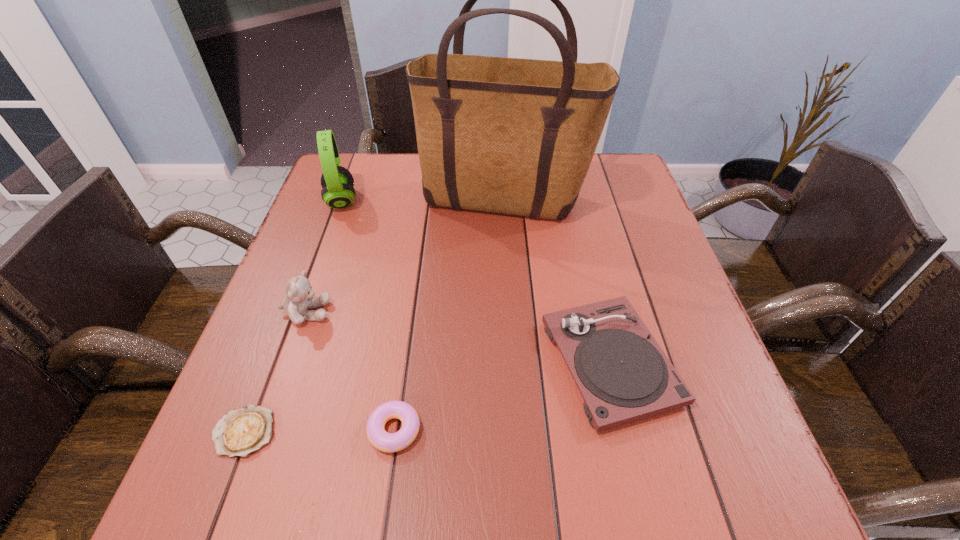
Image resolution: width=960 pixels, height=540 pixels. In order to click on the tallest object in this screenshot , I will do `click(515, 136)`.

The image size is (960, 540). In order to click on headset in this screenshot , I will do `click(337, 182)`.

Find the location of a particular element. The width and height of the screenshot is (960, 540). teddy bear is located at coordinates (299, 298).

The width and height of the screenshot is (960, 540). I want to click on the third shortest object, so click(623, 375).

You are a GUI agent. You are given a task and a screenshot of the screen. Output one action in this format:
    pyautogui.click(x=<x>, y=<y>)
    Task: Click on the fifth tallest object
    This screenshot has width=960, height=540.
    Given the screenshot: What is the action you would take?
    tap(387, 442)

I want to click on the shortest object, so click(240, 432).

Find the location of a particular element. This screenshot has height=540, width=960. free location located on the right of the tallest object is located at coordinates (625, 201).

This screenshot has width=960, height=540. Find the location of `free region located on the right of the headset`. free region located on the right of the headset is located at coordinates (468, 201).

At what (x,y) coordinates should I click in order to perform the action: click on blank area located 0.060m on the face of the fourth shortest object. Please return your answer as a coordinate pair (x, y). Looking at the image, I should click on coord(359,312).

At what (x,y) coordinates should I click in order to perform the action: click on vacant space situated 0.370m on the left of the fourth tallest object. Please return your answer as a coordinate pair (x, y). Looking at the image, I should click on (351, 362).